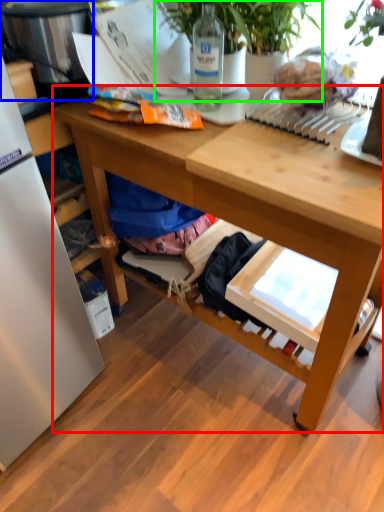
Question: Which object is the farthest from desk (highlighted by a red box)? Choose among these: appliance (highlighted by a blue box) or houseplant (highlighted by a green box).

Choices:
 (A) appliance
 (B) houseplant

Answer: (A)